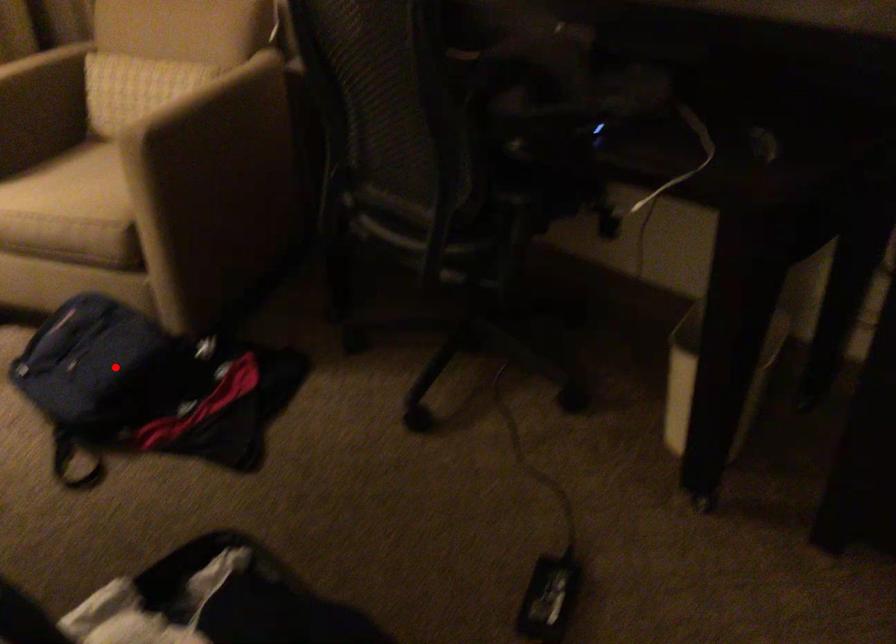
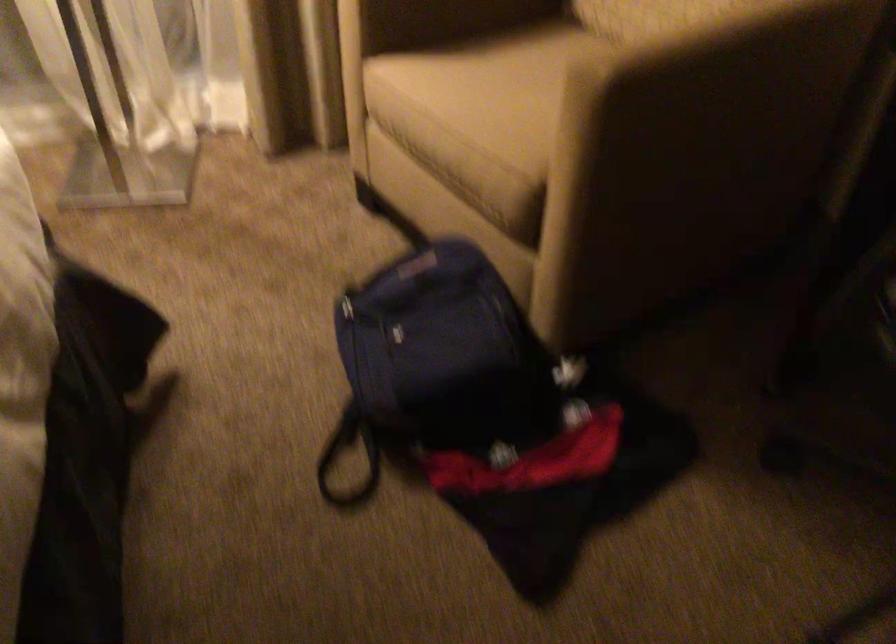
Find the pixel in the second image that matches the highlighted location in the first image.

(442, 366)